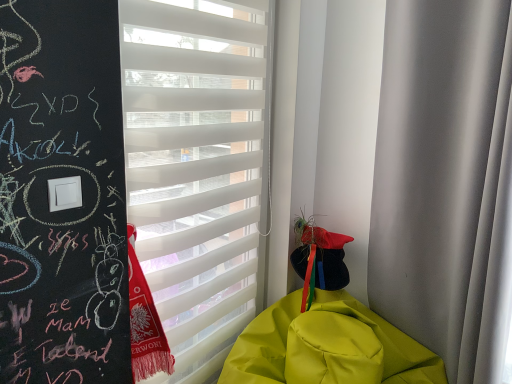
Question: Would you say white matte curtain at right is to the left or to the right of yellow matte blanket at lower right in the picture?

Choices:
 (A) right
 (B) left

Answer: (A)

Question: In terms of height, does white matte curtain at right look taller or shorter compared to yellow matte blanket at lower right?

Choices:
 (A) tall
 (B) short

Answer: (A)

Question: Considering the real-world distances, which object is closest to the white matte curtain at right?

Choices:
 (A) white matte window blind at center
 (B) yellow matte blanket at lower right

Answer: (B)

Question: Based on their relative distances, which object is nearer to the white matte window blind at center?

Choices:
 (A) yellow matte blanket at lower right
 (B) white matte curtain at right

Answer: (A)